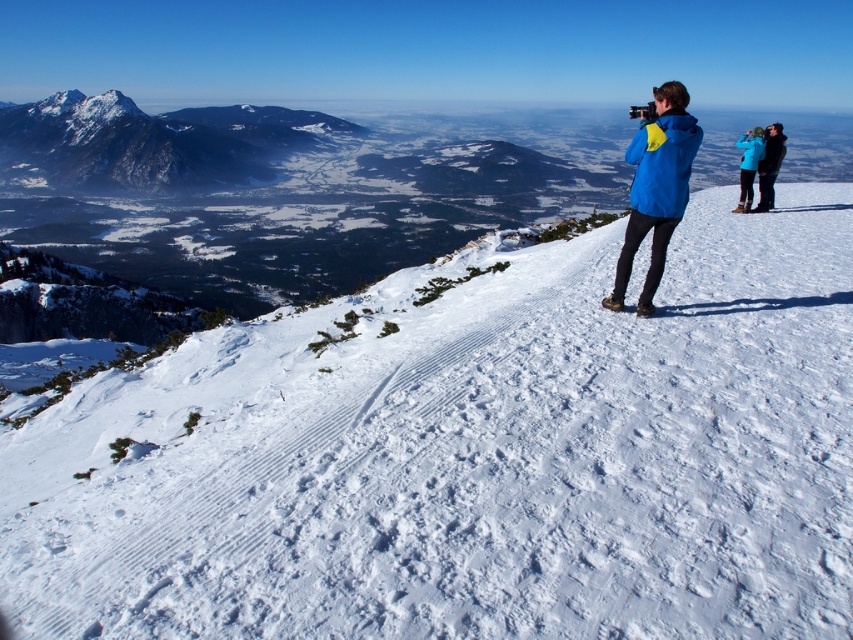
Question: Is white snow at upper center further to camera compared to snowy granite mountain at upper left?

Choices:
 (A) yes
 (B) no

Answer: (B)

Question: From the image, what is the correct spatial relationship of white snow at upper center in relation to snowy granite mountain at upper left?

Choices:
 (A) above
 (B) below

Answer: (B)

Question: Which point appears farthest from the camera in this image?

Choices:
 (A) (749, 180)
 (B) (647, 301)
 (C) (173, 166)

Answer: (C)

Question: Which point is farther from the camera taking this photo?

Choices:
 (A) (618, 529)
 (B) (51, 160)

Answer: (B)

Question: Is blue/yellow jacket at upper right to the right of blue fleece jacket at upper right from the viewer's perspective?

Choices:
 (A) no
 (B) yes

Answer: (A)

Question: Which object appears farthest from the camera in this image?

Choices:
 (A) white snow at upper center
 (B) snowy granite mountain at upper left
 (C) blue fleece jacket at upper right

Answer: (B)